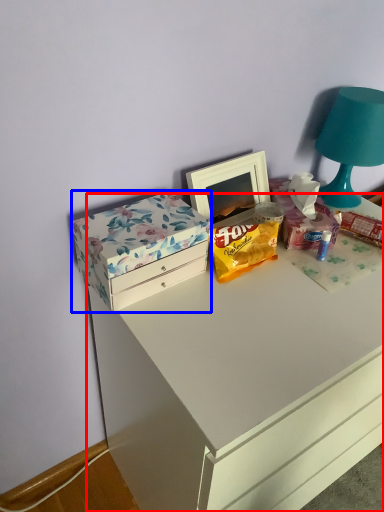
Question: Among these objects, which one is nearest to the camera, chest of drawers (highlighted by a red box) or box (highlighted by a blue box)?

Choices:
 (A) chest of drawers
 (B) box

Answer: (A)